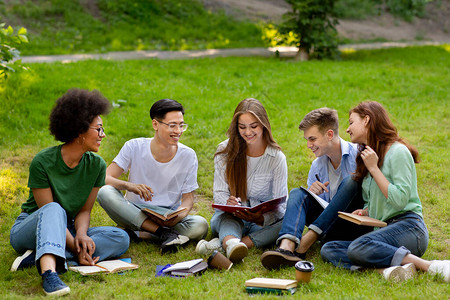
Find the location of a particular element. Image resolution: width=450 pixels, height=300 pixels. open notebook is located at coordinates (117, 268), (170, 216), (249, 211), (323, 203).